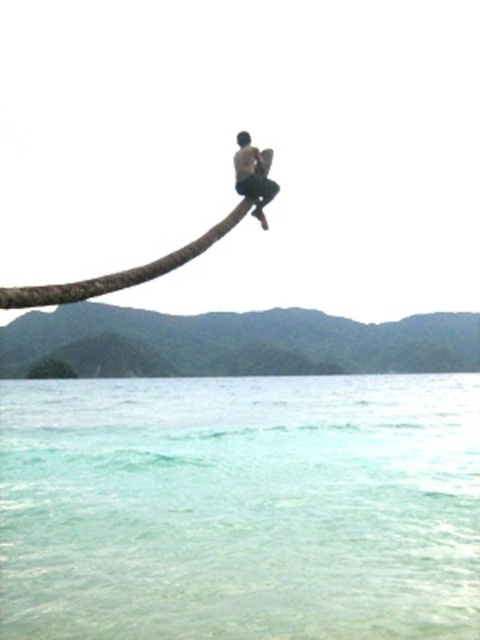
Looking at this image, you are a bird flying above the clear water at lower center and the brown rough tree branch at upper center. You want to land on the nearest object. Which object should you choose?

The brown rough tree branch at upper center is closer to the clear water at lower center than itself, so you should land on the brown rough tree branch at upper center.

You are a photographer trying to capture the dark skin human at center and the green matte tree trunk at lower center in the same frame. Based on their positions, will the human be visible in front of the tree trunk?

The dark skin human at center is behind the green matte tree trunk at lower center, so the human will not be visible in front of the tree trunk.